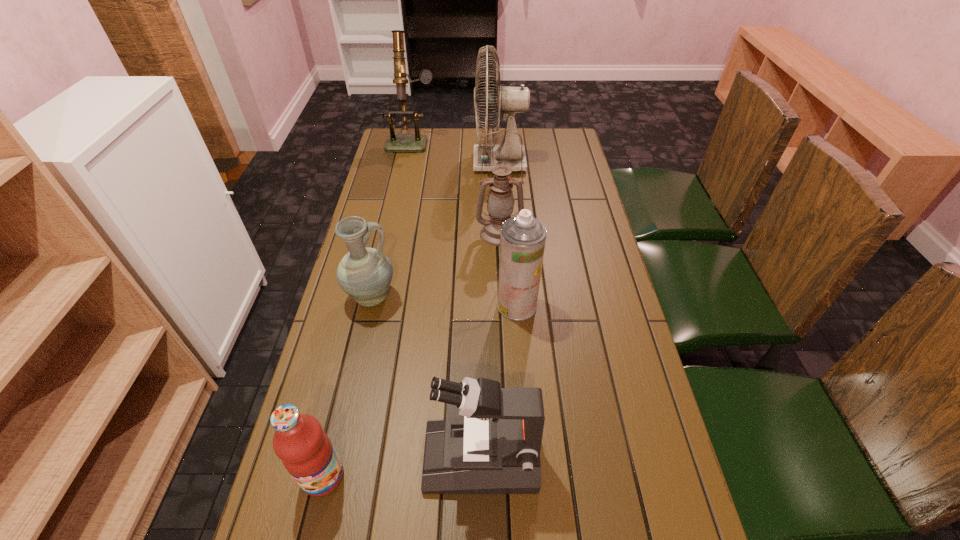
Find the location of a particular element. The image size is (960, 540). free area in between the shorter microscope and the left microscope is located at coordinates (446, 299).

Locate an element on the screen. free space between the pitcher and the fruit juice is located at coordinates (348, 387).

Image resolution: width=960 pixels, height=540 pixels. In order to click on vacant point located between the shorter microscope and the left microscope in this screenshot , I will do click(x=446, y=299).

In order to click on vacant space in between the fruit juice and the pitcher in this screenshot , I will do click(348, 387).

Locate an element on the screen. empty space between the pitcher and the aerosol can is located at coordinates (444, 301).

Find the location of a particular element. the fifth closest object to the fruit juice is located at coordinates (509, 100).

Select which object appears as the fourth closest to the nearer microscope. Please provide its 2D coordinates. Your answer should be formatted as a tuple, i.e. [(x, y)], where the tuple contains the x and y coordinates of a point satisfying the conditions above.

[(500, 203)]

Where is `vacant point that satisfies the following two spatial constraints: 1. on the front-facing side of the fan; 2. on the right side of the aerosol can`? Image resolution: width=960 pixels, height=540 pixels. vacant point that satisfies the following two spatial constraints: 1. on the front-facing side of the fan; 2. on the right side of the aerosol can is located at coordinates (508, 306).

Identify the location of vacant space that satisfies the following two spatial constraints: 1. at the eyepiece of the taller microscope; 2. on the right side of the aerosol can. This screenshot has height=540, width=960. (376, 306).

Identify the location of free space that satisfies the following two spatial constraints: 1. on the back side of the aerosol can; 2. on the handle side of the pitcher. Image resolution: width=960 pixels, height=540 pixels. (516, 298).